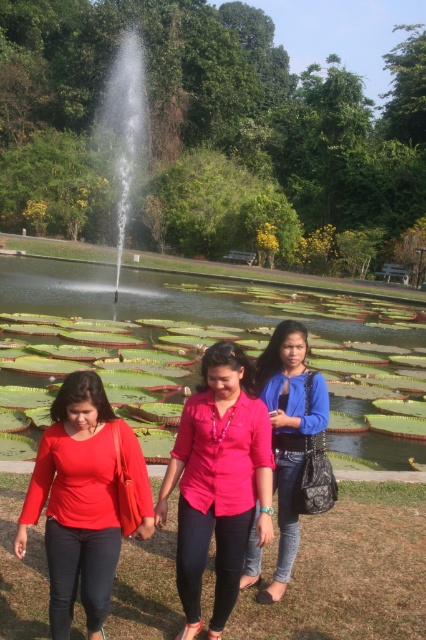
Describe the element at coordinates (216, 481) in the screenshot. This screenshot has height=640, width=426. I see `matte pink blouse at center` at that location.

Is matte pink blouse at center above clear glass fountain at center?

Incorrect, matte pink blouse at center is not positioned above clear glass fountain at center.

Identify the location of matte pink blouse at center. The height and width of the screenshot is (640, 426). (216, 481).

Which is above, green leafy pond at center or matte red blouse at lower left?

green leafy pond at center

From the picture: Does green leafy pond at center have a lesser height compared to matte red blouse at lower left?

No.

Locate an element on the screen. This screenshot has height=640, width=426. green leafy pond at center is located at coordinates (178, 300).

Which is in front, point (69, 598) or point (121, 148)?

Positioned in front is point (69, 598).

Between matte red blouse at lower left and clear glass fountain at center, which one appears on the left side from the viewer's perspective?

clear glass fountain at center is more to the left.

What do you see at coordinates (83, 500) in the screenshot?
I see `matte red blouse at lower left` at bounding box center [83, 500].

The width and height of the screenshot is (426, 640). What are the coordinates of `matte red blouse at lower left` in the screenshot? It's located at (83, 500).